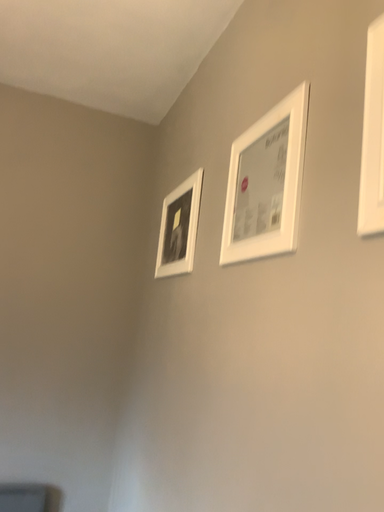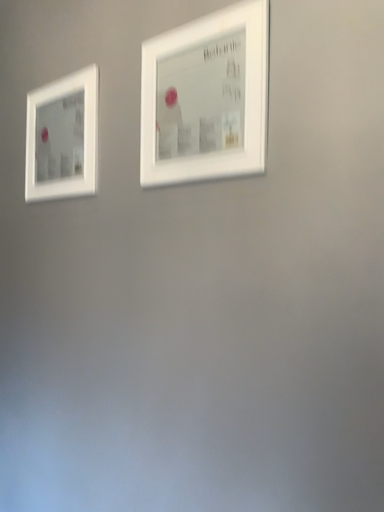
Question: How did the camera likely rotate when shooting the video?

Choices:
 (A) rotated upward
 (B) rotated downward

Answer: (B)